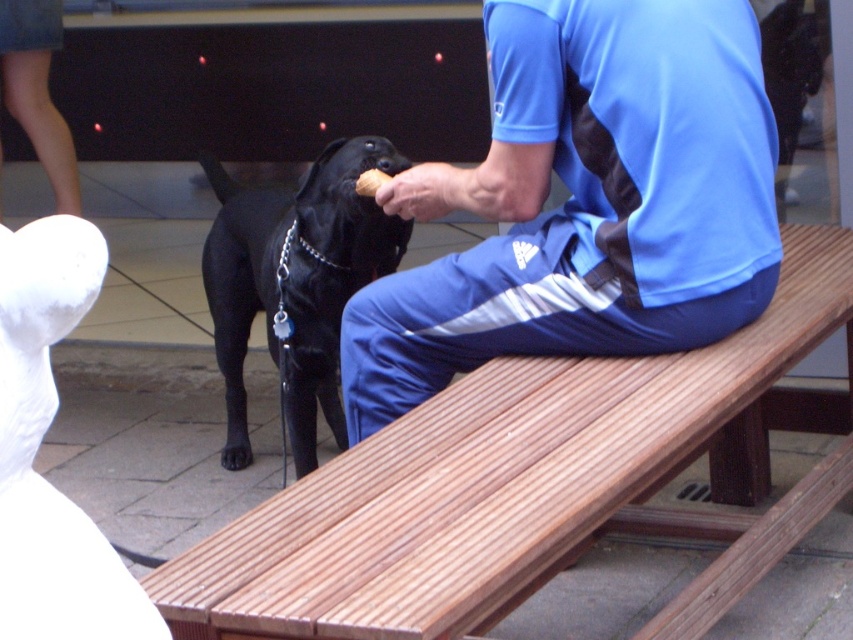
Does black smooth dog at center have a greater width compared to white fabric at upper left?

Indeed, black smooth dog at center has a greater width compared to white fabric at upper left.

Is point (332, 369) positioned after point (57, 156)?

No, it is not.

I want to click on black smooth dog at center, so click(294, 282).

Who is taller, wooden bench at center or blue fabric shirt at upper right?

With more height is blue fabric shirt at upper right.

Is point (635, 464) closer to viewer compared to point (663, 3)?

Yes.

At what (x,y) coordinates should I click in order to perform the action: click on wooden bench at center. Please return your answer as a coordinate pair (x, y). Looking at the image, I should click on (537, 484).

Who is more distant from viewer, (437,344) or (335,268)?

The point (335,268) is behind.

Is point (579, 148) positioned behind point (372, 250)?

That is False.

Is point (631, 13) positioned behind point (241, 220)?

No, (631, 13) is in front of (241, 220).

Locate an element on the screen. The height and width of the screenshot is (640, 853). blue fabric shirt at upper right is located at coordinates coord(585,202).